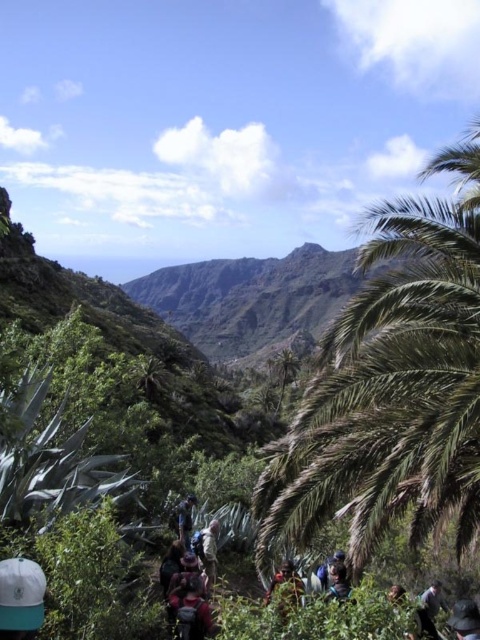
Question: Does dark blue fabric at lower right appear over blue fabric backpack at center?

Choices:
 (A) yes
 (B) no

Answer: (A)

Question: Which object is closer to the camera taking this photo?

Choices:
 (A) red backpack at center
 (B) dark blue fabric at lower right

Answer: (B)

Question: Among these objects, which one is farthest from the camera?

Choices:
 (A) red backpack at center
 (B) white fabric cap at lower left

Answer: (A)

Question: Among these objects, which one is nearest to the camera?

Choices:
 (A) reddish-brown fabric backpack at center
 (B) dark blue fabric at center

Answer: (A)

Question: Does reddish-brown fabric backpack at center appear over blue fabric backpack at center?

Choices:
 (A) yes
 (B) no

Answer: (A)

Question: Can you confirm if white fabric cap at lower left is wider than dark blue fabric at center?

Choices:
 (A) yes
 (B) no

Answer: (A)